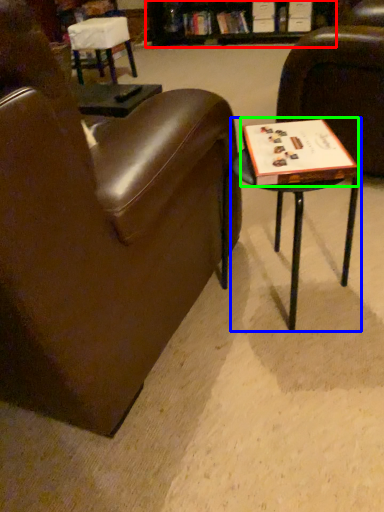
Question: Estimate the real-world distances between objects in this image. Which object is farther from bookshelf (highlighted by a red box), table (highlighted by a blue box) or paperback book (highlighted by a green box)?

Choices:
 (A) table
 (B) paperback book

Answer: (B)